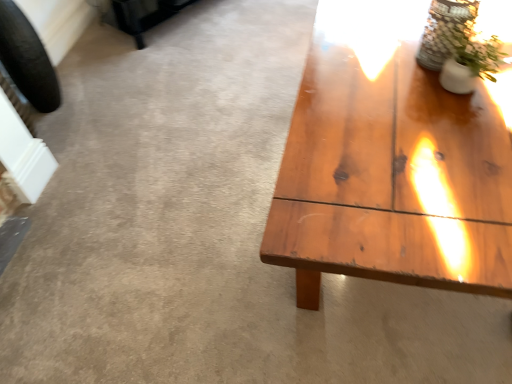
Question: Is white ceramic vase at upper right far from clear glass vase at upper right?

Choices:
 (A) yes
 (B) no

Answer: (B)

Question: Is clear glass vase at upper right at the back of white ceramic vase at upper right?

Choices:
 (A) yes
 (B) no

Answer: (B)

Question: Is clear glass vase at upper right a part of white ceramic vase at upper right?

Choices:
 (A) yes
 (B) no

Answer: (B)

Question: Is the depth of white ceramic vase at upper right greater than that of clear glass vase at upper right?

Choices:
 (A) no
 (B) yes

Answer: (A)

Question: Is white ceramic vase at upper right outside clear glass vase at upper right?

Choices:
 (A) yes
 (B) no

Answer: (A)

Question: Do you think black rubber tire at left is within clear glass vase at upper right, or outside of it?

Choices:
 (A) inside
 (B) outside

Answer: (B)

Question: Considering the positions of black rubber tire at left and clear glass vase at upper right in the image, is black rubber tire at left wider or thinner than clear glass vase at upper right?

Choices:
 (A) thin
 (B) wide

Answer: (A)

Question: Does point (10, 36) appear closer or farther from the camera than point (433, 34)?

Choices:
 (A) closer
 (B) farther

Answer: (B)

Question: Relative to clear glass vase at upper right, is black rubber tire at left in front or behind?

Choices:
 (A) front
 (B) behind

Answer: (B)

Question: Based on their positions, is white ceramic vase at upper right located to the left or right of clear glass vase at upper right?

Choices:
 (A) left
 (B) right

Answer: (B)

Question: From the image's perspective, is white ceramic vase at upper right located above or below clear glass vase at upper right?

Choices:
 (A) below
 (B) above

Answer: (A)

Question: Considering the positions of white ceramic vase at upper right and clear glass vase at upper right in the image, is white ceramic vase at upper right taller or shorter than clear glass vase at upper right?

Choices:
 (A) tall
 (B) short

Answer: (B)

Question: In terms of width, does white ceramic vase at upper right look wider or thinner when compared to clear glass vase at upper right?

Choices:
 (A) wide
 (B) thin

Answer: (B)

Question: Relative to black rubber tire at left, is clear glass vase at upper right in front or behind?

Choices:
 (A) front
 (B) behind

Answer: (A)

Question: Choose the correct answer: Is clear glass vase at upper right inside black rubber tire at left or outside it?

Choices:
 (A) inside
 (B) outside

Answer: (B)